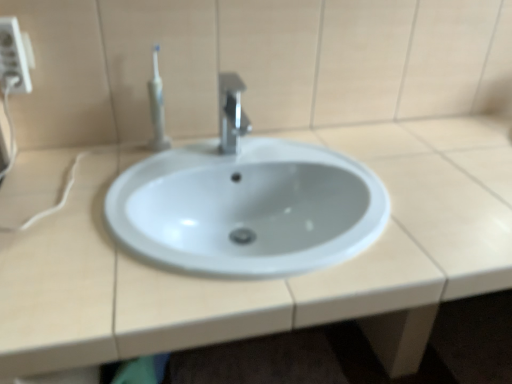
Locate an element on the screen. This screenshot has height=384, width=512. vacant area that is in front of white plastic toothbrush at upper left is located at coordinates (151, 167).